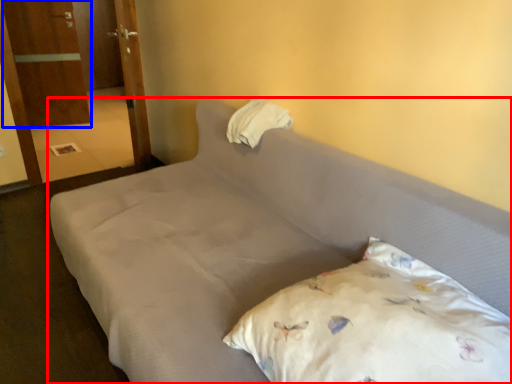
Question: Among these objects, which one is farthest to the camera, bed (highlighted by a red box) or armoire (highlighted by a blue box)?

Choices:
 (A) bed
 (B) armoire

Answer: (B)